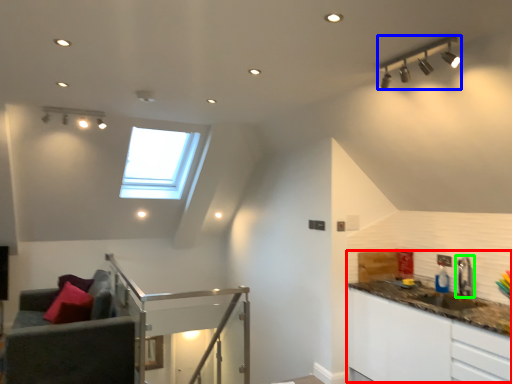
Question: Which is farther away from counter top (highlighted by a red box)? light fixture (highlighted by a blue box) or tap (highlighted by a green box)?

Choices:
 (A) light fixture
 (B) tap

Answer: (A)